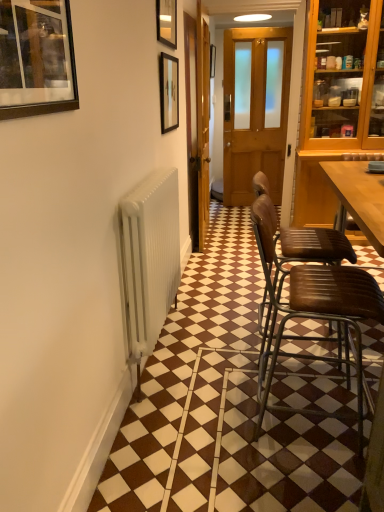
Find the location of `wooden door at center`. wooden door at center is located at coordinates (255, 109).

Measure the distance between point (x=300, y=234) and camera.

Point (x=300, y=234) is 7.18 feet from camera.

What is the approximate width of matte black picture frame at upper center, the 2th picture frame when ordered from top to bottom?

matte black picture frame at upper center, the 2th picture frame when ordered from top to bottom, is 3.55 centimeters in width.

The width and height of the screenshot is (384, 512). What do you see at coordinates (212, 60) in the screenshot?
I see `wooden picture frame at center, positioned as the first picture frame in back-to-front order` at bounding box center [212, 60].

The height and width of the screenshot is (512, 384). What do you see at coordinates (197, 122) in the screenshot?
I see `wooden screen door at center` at bounding box center [197, 122].

Identify the location of wooden screen door at center. (197, 122).

The height and width of the screenshot is (512, 384). I want to click on wooden door at center, so click(255, 109).

Choose the correct answer: Is matte black picture frame at upper center, the 3th picture frame viewed from the left, inside brown leather chair at right, marked as the 1th chair in a front-to-back arrangement, or outside it?

matte black picture frame at upper center, the 3th picture frame viewed from the left, exists outside the volume of brown leather chair at right, marked as the 1th chair in a front-to-back arrangement.

Does matte black picture frame at upper center, which appears as the 3th picture frame when viewed from the back, turn towards brown leather chair at right, which appears as the 2th chair when viewed from the back?

No, matte black picture frame at upper center, which appears as the 3th picture frame when viewed from the back, does not turn towards brown leather chair at right, which appears as the 2th chair when viewed from the back.

Does matte black picture frame at upper center, marked as the second picture frame in a front-to-back arrangement, have a greater width compared to brown leather chair at right, which appears as the 2th chair when viewed from the back?

In fact, matte black picture frame at upper center, marked as the second picture frame in a front-to-back arrangement, might be narrower than brown leather chair at right, which appears as the 2th chair when viewed from the back.

From the image's perspective, which is above, matte black picture frame at upper center, the second picture frame viewed from the right, or brown leather chair at right, which appears as the 2th chair when viewed from the back?

From the image's view, matte black picture frame at upper center, the second picture frame viewed from the right, is above.

Between wooden picture frame at center, which ranks as the first picture frame in right-to-left order, and wooden screen door at center, which one has larger size?

Bigger between the two is wooden screen door at center.

Which is in front, point (215, 48) or point (200, 224)?

Positioned in front is point (200, 224).

Find the location of a particular element. Image resolution: width=384 pixels, height=512 pixels. screen door on the left of wooden picture frame at center, which ranks as the fourth picture frame in bottom-to-top order is located at coordinates (197, 122).

From the image's perspective, which object appears higher, wooden picture frame at center, which ranks as the first picture frame in right-to-left order, or wooden screen door at center?

wooden picture frame at center, which ranks as the first picture frame in right-to-left order.

What's the angular difference between matte black picture frame at upper center, positioned as the 2th picture frame in back-to-front order, and brown leather chair at right, which appears as the 2th chair when viewed from the back,'s facing directions?

The facing directions of matte black picture frame at upper center, positioned as the 2th picture frame in back-to-front order, and brown leather chair at right, which appears as the 2th chair when viewed from the back, are 1.76 degrees apart.

Considering the relative sizes of matte black picture frame at upper center, which is the third picture frame from front to back, and brown leather chair at right, which appears as the 2th chair when viewed from the back, in the image provided, is matte black picture frame at upper center, which is the third picture frame from front to back, taller than brown leather chair at right, which appears as the 2th chair when viewed from the back,?

Incorrect, the height of matte black picture frame at upper center, which is the third picture frame from front to back, is not larger of that of brown leather chair at right, which appears as the 2th chair when viewed from the back.

From the picture: Which object is further away from the camera, matte black picture frame at upper center, the third picture frame from the right, or brown leather chair at right, which appears as the 2th chair when viewed from the back?

matte black picture frame at upper center, the third picture frame from the right, is further away from the camera.

From the brown leather chair at right, which appears as the 2th chair when viewed from the back, count the 3rd picture frame to the left and point to it. Please provide its 2D coordinates.

[(169, 92)]

Find the location of `door below the matte black picture frame at upper center, the second picture frame viewed from the right (from the image's perspective)`. door below the matte black picture frame at upper center, the second picture frame viewed from the right (from the image's perspective) is located at coordinates (255, 109).

Is matte black picture frame at upper center, marked as the second picture frame in a front-to-back arrangement, far away from wooden door at center?

matte black picture frame at upper center, marked as the second picture frame in a front-to-back arrangement, is positioned a significant distance from wooden door at center.

Is the position of matte black picture frame at upper center, the 2th picture frame when ordered from top to bottom, less distant than that of wooden door at center?

Yes, the depth of matte black picture frame at upper center, the 2th picture frame when ordered from top to bottom, is less than that of wooden door at center.

Are wooden screen door at center and brown leather chair at right, the 2th chair viewed from the front, located far from each other?

Yes, wooden screen door at center is far from brown leather chair at right, the 2th chair viewed from the front.

Which is more to the right, wooden screen door at center or brown leather chair at right, the 2th chair viewed from the front?

brown leather chair at right, the 2th chair viewed from the front, is more to the right.

The height and width of the screenshot is (512, 384). I want to click on screen door behind the brown leather chair at right, the 2th chair viewed from the front, so pos(197,122).

Based on the photo, is wooden screen door at center smaller than brown leather chair at right, which is the first chair in back-to-front order?

No, wooden screen door at center is not smaller than brown leather chair at right, which is the first chair in back-to-front order.

Considering their positions, is brown leather chair at right, marked as the 1th chair in a front-to-back arrangement, located in front of or behind wooden door at center?

Clearly, brown leather chair at right, marked as the 1th chair in a front-to-back arrangement, is in front of wooden door at center.

From the image's perspective, would you say brown leather chair at right, marked as the 1th chair in a front-to-back arrangement, is shown under wooden door at center?

Yes, from the image's perspective, brown leather chair at right, marked as the 1th chair in a front-to-back arrangement, is below wooden door at center.

What's the angular difference between brown leather chair at right, which appears as the 2th chair when viewed from the back, and wooden door at center's facing directions?

88 degrees.

From the image's perspective, is matte black picture frame at upper center, the second picture frame from the left, above or below wooden door at center?

Clearly, from the image's perspective, matte black picture frame at upper center, the second picture frame from the left, is below wooden door at center.

Is matte black picture frame at upper center, positioned as the 2th picture frame in back-to-front order, beside wooden door at center?

No, matte black picture frame at upper center, positioned as the 2th picture frame in back-to-front order, is not making contact with wooden door at center.

Where is `door behind the matte black picture frame at upper center, arranged as the 3th picture frame when viewed from the top`? The width and height of the screenshot is (384, 512). door behind the matte black picture frame at upper center, arranged as the 3th picture frame when viewed from the top is located at coordinates (255, 109).

Which is closer to the camera, (169,97) or (224,132)?

Point (169,97).

Locate an element on the screen. The height and width of the screenshot is (512, 384). chair that is the 1st one when counting rightward from the matte black picture frame at upper center, the 2th picture frame when ordered from top to bottom is located at coordinates (313, 312).

Find the location of `picture frame behind the wooden screen door at center`. picture frame behind the wooden screen door at center is located at coordinates (212, 60).

Looking at the image, which one is located closer to brown leather chair at right, which is the first chair in back-to-front order, matte black picture frame at upper center, the second picture frame from the left, or brown leather chair at right, marked as the 1th chair in a front-to-back arrangement?

The object closer to brown leather chair at right, which is the first chair in back-to-front order, is brown leather chair at right, marked as the 1th chair in a front-to-back arrangement.

From the image, which object appears to be farther from matte black picture frame at upper center, the 2th picture frame when ordered from top to bottom, wooden screen door at center or brown leather chair at right, the 2th chair viewed from the front?

brown leather chair at right, the 2th chair viewed from the front, is further to matte black picture frame at upper center, the 2th picture frame when ordered from top to bottom.

From the image, which object appears to be nearer to matte black picture frame at upper center, the 2th picture frame in the bottom-to-top sequence, wooden screen door at center or matte black picture frame at upper left, which is counted as the fourth picture frame, starting from the right?

The object closer to matte black picture frame at upper center, the 2th picture frame in the bottom-to-top sequence, is wooden screen door at center.

Estimate the real-world distances between objects in this image. Which object is further from matte black picture frame at upper center, the third picture frame from the right, wooden door at center or matte black picture frame at upper center, marked as the second picture frame in a front-to-back arrangement?

Among the two, wooden door at center is located further to matte black picture frame at upper center, the third picture frame from the right.

Considering their positions, is matte black picture frame at upper left, positioned as the first picture frame in left-to-right order, positioned closer to wooden door at center than brown leather chair at right, the 2th chair viewed from the front?

brown leather chair at right, the 2th chair viewed from the front.

Looking at this image, from the image, which object appears to be farther from wooden screen door at center, wooden door at center or wooden picture frame at center, acting as the 4th picture frame starting from the front?

wooden picture frame at center, acting as the 4th picture frame starting from the front, is positioned further to the anchor wooden screen door at center.

Consider the image. Looking at the image, which one is located closer to wooden door at center, matte black picture frame at upper center, arranged as the 3th picture frame when viewed from the top, or brown leather chair at right, marked as the 1th chair in a front-to-back arrangement?

The object closer to wooden door at center is matte black picture frame at upper center, arranged as the 3th picture frame when viewed from the top.

Looking at the image, which one is located closer to matte black picture frame at upper center, which appears as the 3th picture frame when viewed from the back, matte black picture frame at upper left, the fourth picture frame when ordered from top to bottom, or wooden screen door at center?

Based on the image, wooden screen door at center appears to be nearer to matte black picture frame at upper center, which appears as the 3th picture frame when viewed from the back.

In order to click on screen door that lies between matte black picture frame at upper center, which appears as the 3th picture frame when viewed from the back, and brown leather chair at right, which appears as the 2th chair when viewed from the back, from top to bottom in this screenshot , I will do `click(197, 122)`.

Locate an element on the screen. picture frame between matte black picture frame at upper left, the fourth picture frame in the back-to-front sequence, and matte black picture frame at upper center, the third picture frame from the right, in the front-back direction is located at coordinates (167, 22).

Find the location of a particular element. This screenshot has width=384, height=512. screen door between matte black picture frame at upper center, which appears as the 3th picture frame when viewed from the back, and wooden door at center, along the z-axis is located at coordinates (197, 122).

You are a GUI agent. You are given a task and a screenshot of the screen. Output one action in this format:
    pyautogui.click(x=<x>, y=<y>)
    Task: Click on the screen door between matte black picture frame at upper center, the 2th picture frame when ordered from top to bottom, and wooden picture frame at center, positioned as the first picture frame in back-to-front order, in the front-back direction
    Image resolution: width=384 pixels, height=512 pixels.
    Given the screenshot: What is the action you would take?
    pyautogui.click(x=197, y=122)